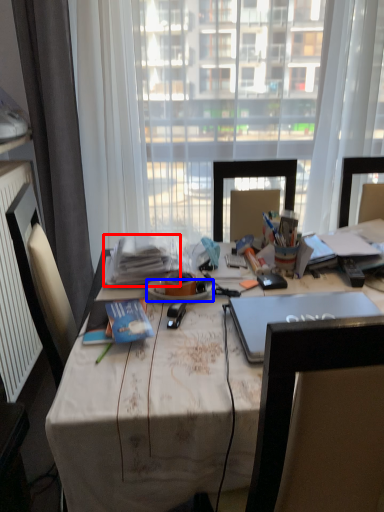
Question: Which object appears farthest to the camera in this image, book (highlighted by a red box) or plate (highlighted by a blue box)?

Choices:
 (A) book
 (B) plate

Answer: (A)